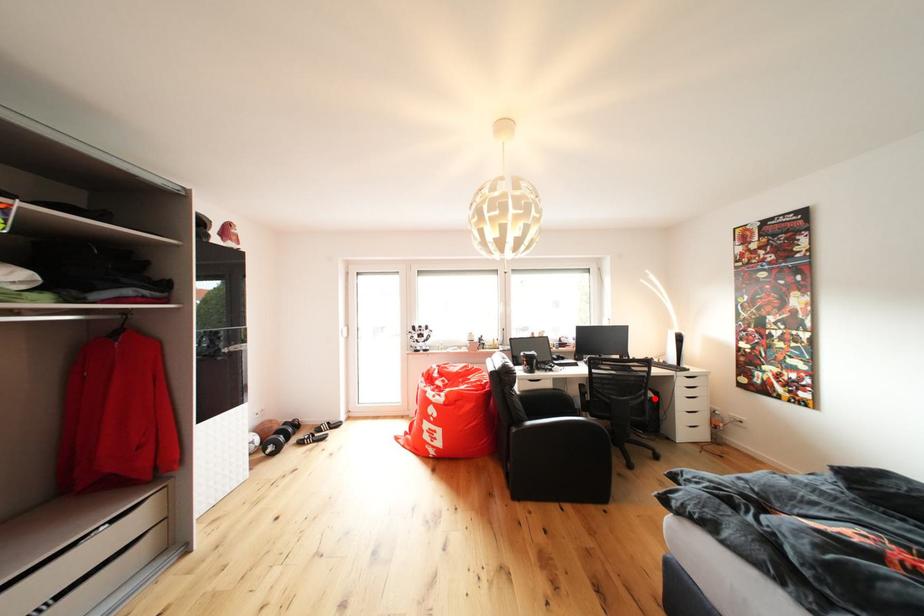
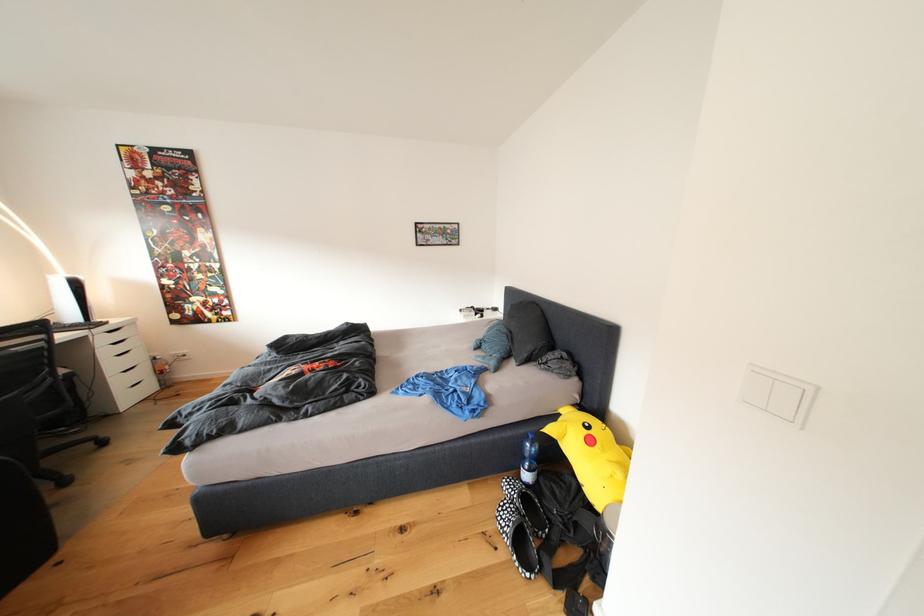
Find the pixel in the second image that matches the highlighted location in the first image.

(63, 378)